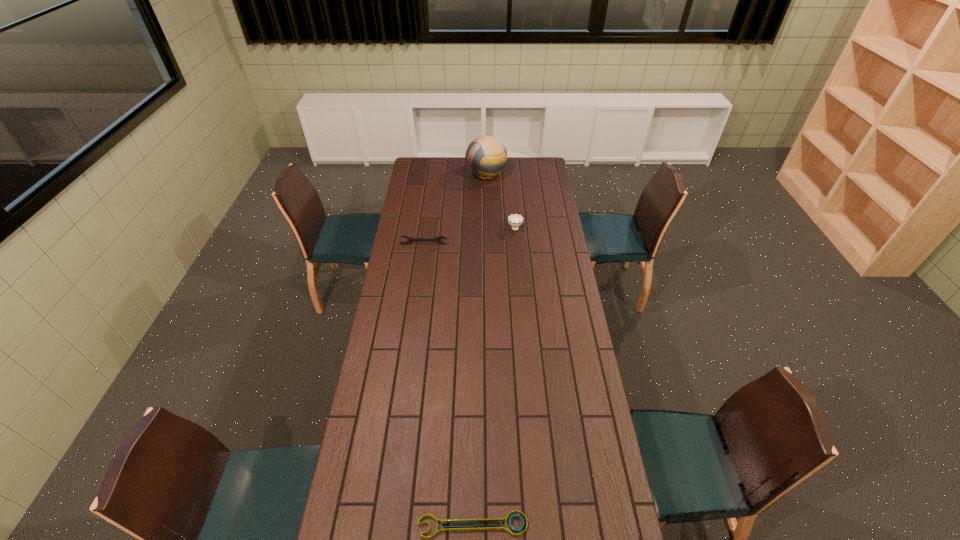
Locate an element on the screen. The height and width of the screenshot is (540, 960). free space between the volleyball and the nearer wrench is located at coordinates (479, 349).

In order to click on empty space between the second tallest object and the tallest object in this screenshot , I will do `click(500, 200)`.

This screenshot has width=960, height=540. I want to click on free space between the shorter wrench and the cup, so click(493, 376).

At what (x,y) coordinates should I click in order to perform the action: click on vacant point located between the second nearest object and the tallest object. Please return your answer as a coordinate pair (x, y). This screenshot has height=540, width=960. Looking at the image, I should click on (455, 208).

This screenshot has height=540, width=960. Find the location of `free spot between the second shortest object and the volleyball`. free spot between the second shortest object and the volleyball is located at coordinates (455, 208).

Locate an element on the screen. Image resolution: width=960 pixels, height=540 pixels. vacant area between the taller wrench and the volleyball is located at coordinates (455, 208).

The image size is (960, 540). I want to click on free space between the third nearest object and the shortest object, so click(x=493, y=376).

The width and height of the screenshot is (960, 540). In order to click on free point between the volleyball and the taller wrench in this screenshot , I will do [x=455, y=208].

You are a GUI agent. You are given a task and a screenshot of the screen. Output one action in this format:
    pyautogui.click(x=<x>, y=<y>)
    Task: Click on the vacant space in between the shortest object and the cup
    The height and width of the screenshot is (540, 960).
    Given the screenshot: What is the action you would take?
    pyautogui.click(x=493, y=376)

The width and height of the screenshot is (960, 540). Find the location of `empty space that is in between the farthest object and the second tallest object`. empty space that is in between the farthest object and the second tallest object is located at coordinates (500, 200).